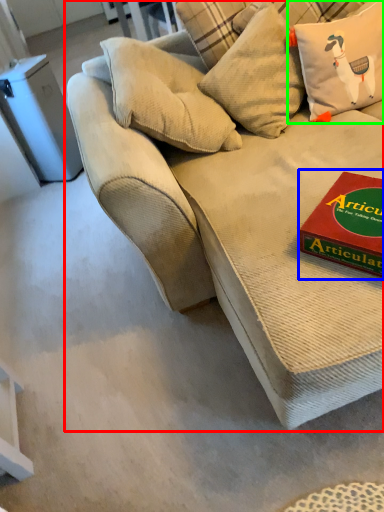
Question: Which object is the farthest from studio couch (highlighted by a red box)? Choose among these: paperback book (highlighted by a blue box) or pillow (highlighted by a green box).

Choices:
 (A) paperback book
 (B) pillow

Answer: (B)